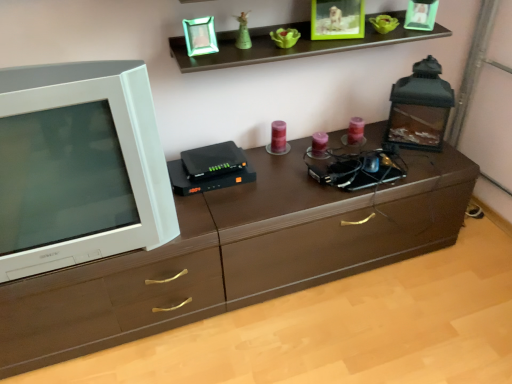
Question: Should I look upward or downward to see white glossy television at left?

Choices:
 (A) up
 (B) down

Answer: (A)

Question: Is brown wood chest of drawers at center positioned behind white glossy television at left?

Choices:
 (A) yes
 (B) no

Answer: (A)

Question: From the image's perspective, is brown wood chest of drawers at center under white glossy television at left?

Choices:
 (A) no
 (B) yes

Answer: (B)

Question: From the image's perspective, would you say brown wood chest of drawers at center is positioned over white glossy television at left?

Choices:
 (A) no
 (B) yes

Answer: (A)

Question: Is brown wood chest of drawers at center in front of white glossy television at left?

Choices:
 (A) no
 (B) yes

Answer: (A)

Question: Considering the relative sizes of brown wood chest of drawers at center and white glossy television at left in the image provided, is brown wood chest of drawers at center taller than white glossy television at left?

Choices:
 (A) yes
 (B) no

Answer: (B)

Question: Is white glossy television at left at the back of brown wood chest of drawers at center?

Choices:
 (A) yes
 (B) no

Answer: (B)

Question: Can you confirm if white glossy television at left is taller than brown wood chest of drawers at center?

Choices:
 (A) no
 (B) yes

Answer: (B)

Question: Is brown wood chest of drawers at center inside white glossy television at left?

Choices:
 (A) no
 (B) yes

Answer: (A)

Question: Considering the relative sizes of white glossy television at left and brown wood chest of drawers at center in the image provided, is white glossy television at left bigger than brown wood chest of drawers at center?

Choices:
 (A) no
 (B) yes

Answer: (B)

Question: Is white glossy television at left shorter than brown wood chest of drawers at center?

Choices:
 (A) no
 (B) yes

Answer: (A)

Question: Does white glossy television at left turn towards brown wood chest of drawers at center?

Choices:
 (A) yes
 (B) no

Answer: (B)

Question: Is white glossy television at left facing away from brown wood chest of drawers at center?

Choices:
 (A) no
 (B) yes

Answer: (A)

Question: Is brown wood chest of drawers at center at the back of green glossy statue at upper center?

Choices:
 (A) yes
 (B) no

Answer: (B)